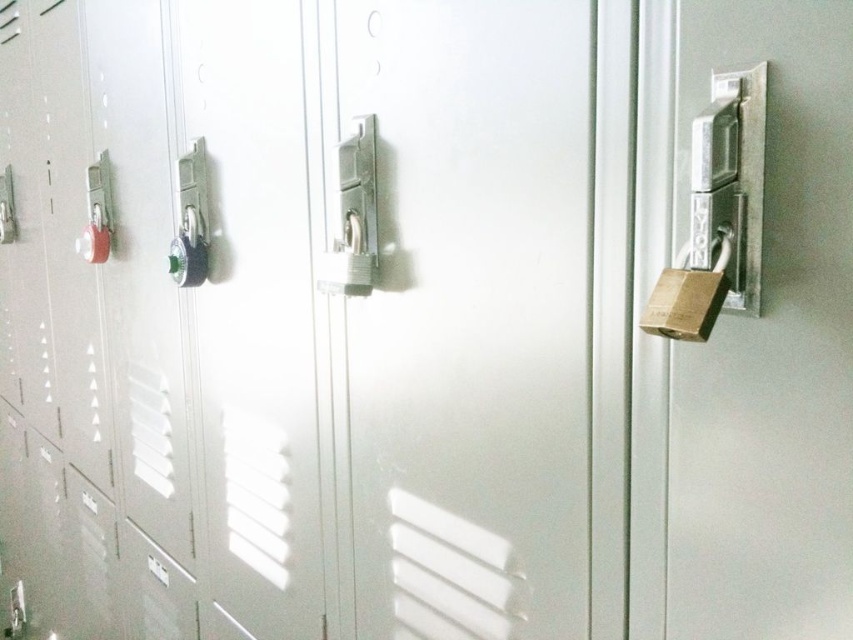
Where is `gold metallic padlock at right`? This screenshot has width=853, height=640. gold metallic padlock at right is located at coordinates (718, 214).

Is gold metallic padlock at right taller than green plastic door handle at center?

Incorrect, gold metallic padlock at right's height is not larger of green plastic door handle at center's.

Is point (711, 236) less distant than point (172, 237)?

That is True.

Identify the location of gold metallic padlock at right. The image size is (853, 640). (718, 214).

Can you confirm if gold metallic padlock at right is bigger than metallic silver lock at center?

No, gold metallic padlock at right is not bigger than metallic silver lock at center.

Does gold metallic padlock at right appear on the left side of metallic silver lock at center?

No, gold metallic padlock at right is not to the left of metallic silver lock at center.

In order to click on gold metallic padlock at right in this screenshot , I will do `click(718, 214)`.

Measure the distance from metallic silver lock at center to green plastic door handle at center.

metallic silver lock at center and green plastic door handle at center are 18.18 inches apart from each other.

Which is behind, point (364, 141) or point (193, 273)?

Point (193, 273)

This screenshot has width=853, height=640. I want to click on metallic silver lock at center, so click(x=352, y=216).